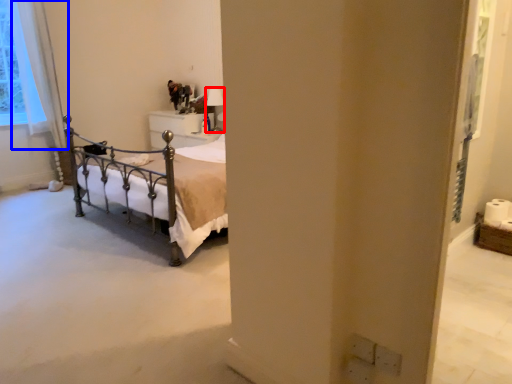
Question: Which point is further to the camera, lamp (highlighted by a red box) or curtain (highlighted by a blue box)?

Choices:
 (A) lamp
 (B) curtain

Answer: (A)